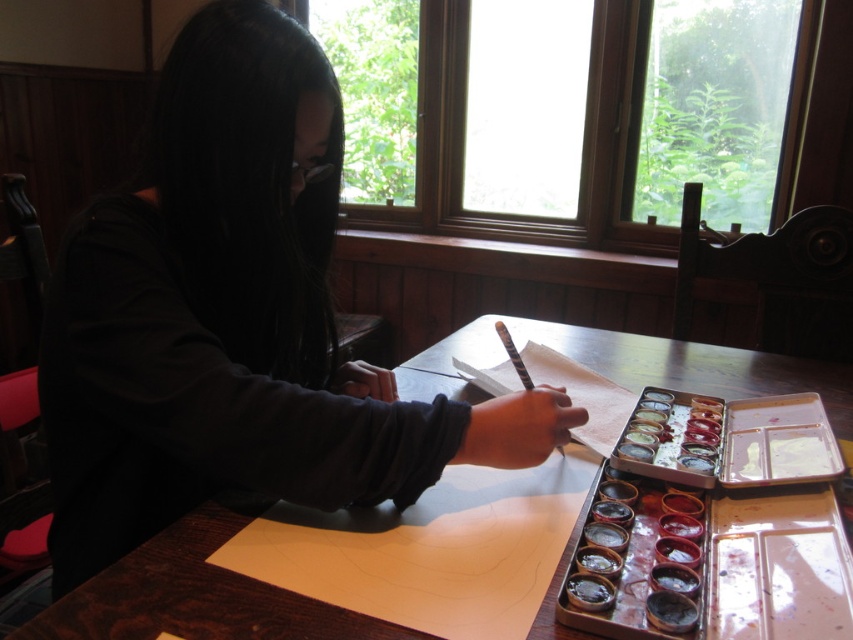
From the picture: Does matte black shirt at center have a lesser height compared to black textured paintbrush at center?

Incorrect, matte black shirt at center's height does not fall short of black textured paintbrush at center's.

Measure the distance between matte black shirt at center and black textured paintbrush at center.

The distance of matte black shirt at center from black textured paintbrush at center is 32.42 centimeters.

This screenshot has height=640, width=853. Describe the element at coordinates (233, 320) in the screenshot. I see `matte black shirt at center` at that location.

At what (x,y) coordinates should I click in order to perform the action: click on matte black shirt at center. Please return your answer as a coordinate pair (x, y). The image size is (853, 640). Looking at the image, I should click on (233, 320).

What do you see at coordinates (233, 320) in the screenshot? The height and width of the screenshot is (640, 853). I see `matte black shirt at center` at bounding box center [233, 320].

Where is `matte black shirt at center`? This screenshot has width=853, height=640. matte black shirt at center is located at coordinates (233, 320).

Can you confirm if wooden table at center is thinner than black textured paintbrush at center?

No.

Based on the photo, who is more distant from viewer, [836,388] or [532,387]?

Point [836,388]

Where is `wooden table at center`? wooden table at center is located at coordinates click(194, 596).